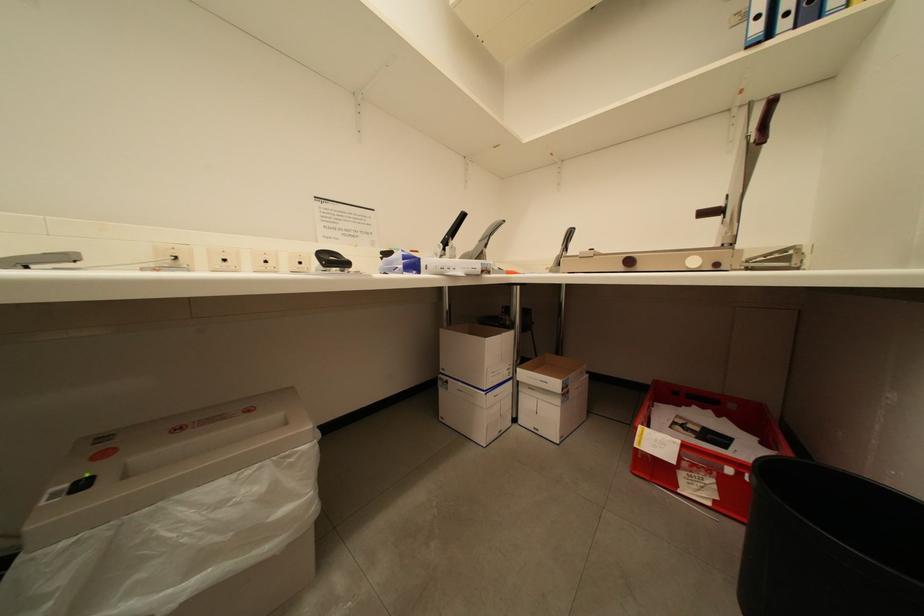
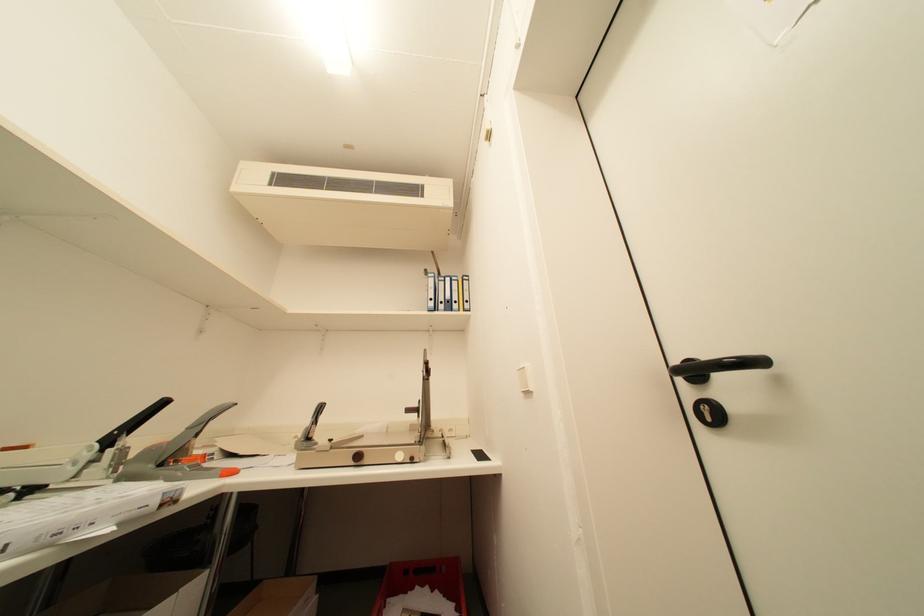
Looking at this image, the images are taken continuously from a first-person perspective. In which direction is your viewpoint rotating?

The camera rotated toward right-up.